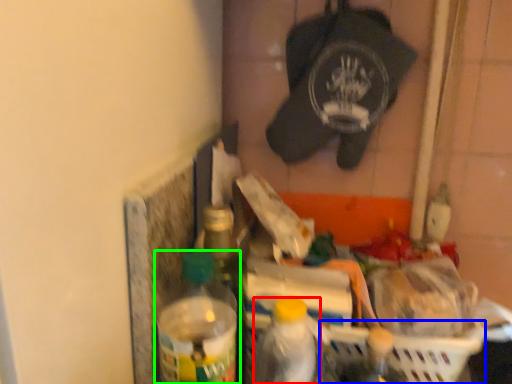
Question: Which is farther away from bottle (highlighted by a red box)? basket (highlighted by a blue box) or bottle (highlighted by a green box)?

Choices:
 (A) basket
 (B) bottle

Answer: (A)